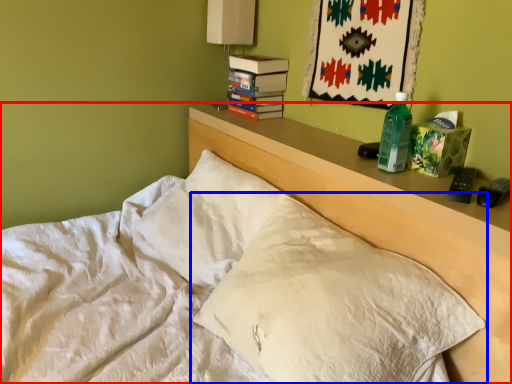
Question: Which object is closer to the camera taking this photo, bed (highlighted by a red box) or pillow (highlighted by a blue box)?

Choices:
 (A) bed
 (B) pillow

Answer: (A)